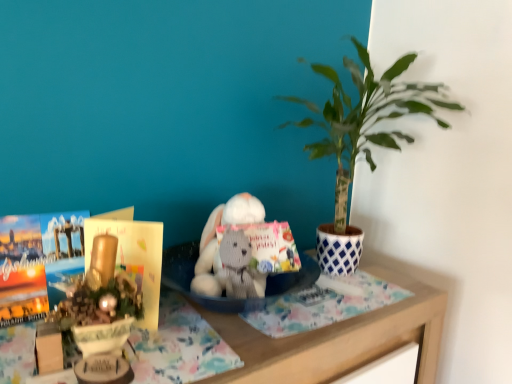
Where is `vacant area on top of fluffy white cloth at center (from a real-world perspective)`? This screenshot has width=512, height=384. vacant area on top of fluffy white cloth at center (from a real-world perspective) is located at coordinates (331, 295).